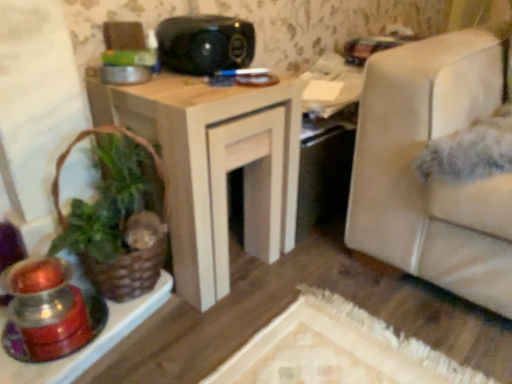
What is the approximate height of black plastic speaker at upper center?

black plastic speaker at upper center is 4.81 inches in height.

The width and height of the screenshot is (512, 384). Describe the element at coordinates (129, 274) in the screenshot. I see `brown woven basket at left` at that location.

Image resolution: width=512 pixels, height=384 pixels. What do you see at coordinates (215, 167) in the screenshot?
I see `wooden table at center` at bounding box center [215, 167].

This screenshot has height=384, width=512. I want to click on black plastic speaker at upper center, so click(205, 44).

From a real-world perspective, is black plastic speaker at upper center over wooden table at center?

Correct, in the physical world, black plastic speaker at upper center is higher than wooden table at center.

Is wooden table at center inside black plastic speaker at upper center?

No, wooden table at center is not inside black plastic speaker at upper center.

Image resolution: width=512 pixels, height=384 pixels. I want to click on speaker above the wooden table at center (from the image's perspective), so click(x=205, y=44).

Is black plastic speaker at upper center touching wooden table at center?

No, black plastic speaker at upper center is not beside wooden table at center.

Looking at this image, from the image's perspective, which one is positioned higher, wooden table at center or translucent glass candle holder at lower left?

wooden table at center, from the image's perspective.

In the scene shown: Is the surface of wooden table at center in direct contact with translucent glass candle holder at lower left?

No, wooden table at center is not beside translucent glass candle holder at lower left.

Is wooden table at center located outside translucent glass candle holder at lower left?

Yes, wooden table at center is located beyond the bounds of translucent glass candle holder at lower left.

Can you tell me how much wooden table at center and translucent glass candle holder at lower left differ in facing direction?

3.72 degrees.

Does translucent glass candle holder at lower left have a lesser width compared to wooden table at center?

Yes.

Is translucent glass candle holder at lower left spatially inside wooden table at center, or outside of it?

translucent glass candle holder at lower left is not enclosed by wooden table at center.

Considering the relative sizes of translucent glass candle holder at lower left and wooden table at center in the image provided, is translucent glass candle holder at lower left bigger than wooden table at center?

No.

How different are the orientations of translucent glass candle holder at lower left and wooden table at center in degrees?

translucent glass candle holder at lower left and wooden table at center are facing 3.72 degrees away from each other.

Which of these two, wooden table at center or black plastic speaker at upper center, is smaller?

black plastic speaker at upper center is smaller.

Can you tell me how much wooden table at center and black plastic speaker at upper center differ in facing direction?

1.79 degrees.

Is the surface of wooden table at center in direct contact with black plastic speaker at upper center?

wooden table at center and black plastic speaker at upper center are clearly separated.

Which of these two, wooden table at center or black plastic speaker at upper center, is thinner?

Thinner between the two is black plastic speaker at upper center.

Based on the photo, considering the sizes of objects wooden table at center and brown woven basket at left in the image provided, who is smaller, wooden table at center or brown woven basket at left?

With smaller size is brown woven basket at left.

I want to click on houseplant above the wooden table at center (from a real-world perspective), so click(129, 274).

From the picture: Relative to brown woven basket at left, is wooden table at center in front or behind?

wooden table at center is behind brown woven basket at left.

Does wooden table at center turn towards brown woven basket at left?

No, wooden table at center is not oriented towards brown woven basket at left.

Is black plastic speaker at upper center taller than brown woven basket at left?

No.

Based on their positions, is black plastic speaker at upper center located to the left or right of brown woven basket at left?

black plastic speaker at upper center is positioned on brown woven basket at left's right side.

Does point (216, 27) appear closer or farther from the camera than point (117, 283)?

Point (216, 27).

Is black plastic speaker at upper center further to the viewer compared to brown woven basket at left?

Yes, black plastic speaker at upper center is further from the camera.

Is translucent glass candle holder at lower left closer to camera compared to brown woven basket at left?

Yes, translucent glass candle holder at lower left is in front of brown woven basket at left.

Is brown woven basket at left surrounded by translucent glass candle holder at lower left?

No, brown woven basket at left is not surrounded by translucent glass candle holder at lower left.

Is translucent glass candle holder at lower left turned away from brown woven basket at left?

No, translucent glass candle holder at lower left is not facing the opposite direction of brown woven basket at left.

You are a GUI agent. You are given a task and a screenshot of the screen. Output one action in this format:
    pyautogui.click(x=<x>, y=<y>)
    Task: Click on the table lying in front of the black plastic speaker at upper center
    The width and height of the screenshot is (512, 384).
    Given the screenshot: What is the action you would take?
    pyautogui.click(x=215, y=167)

What are the coordinates of `table that appears behind the translucent glass candle holder at lower left` in the screenshot? It's located at (215, 167).

From the image, which object appears to be nearer to translucent glass candle holder at lower left, brown woven basket at left or wooden table at center?

Based on the image, brown woven basket at left appears to be nearer to translucent glass candle holder at lower left.

Looking at the image, which one is located further to black plastic speaker at upper center, translucent glass candle holder at lower left or wooden table at center?

Based on the image, translucent glass candle holder at lower left appears to be further to black plastic speaker at upper center.

When comparing their distances from black plastic speaker at upper center, does wooden table at center or brown woven basket at left seem closer?

wooden table at center is positioned closer to the anchor black plastic speaker at upper center.

Considering their positions, is black plastic speaker at upper center positioned closer to translucent glass candle holder at lower left than wooden table at center?

Based on the image, wooden table at center appears to be nearer to translucent glass candle holder at lower left.

Which object lies further to the anchor point wooden table at center, translucent glass candle holder at lower left or brown woven basket at left?

Based on the image, translucent glass candle holder at lower left appears to be further to wooden table at center.

Based on their spatial positions, is translucent glass candle holder at lower left or brown woven basket at left closer to black plastic speaker at upper center?

Among the two, brown woven basket at left is located nearer to black plastic speaker at upper center.

Based on their spatial positions, is brown woven basket at left or wooden table at center further from black plastic speaker at upper center?

brown woven basket at left is further to black plastic speaker at upper center.

Estimate the real-world distances between objects in this image. Which object is further from wooden table at center, translucent glass candle holder at lower left or black plastic speaker at upper center?

translucent glass candle holder at lower left is further to wooden table at center.

Where is `table between black plastic speaker at upper center and translucent glass candle holder at lower left from top to bottom`? table between black plastic speaker at upper center and translucent glass candle holder at lower left from top to bottom is located at coordinates (215, 167).

Identify the location of houseplant between black plastic speaker at upper center and translucent glass candle holder at lower left in the vertical direction. (129, 274).

The height and width of the screenshot is (384, 512). Identify the location of table between black plastic speaker at upper center and brown woven basket at left vertically. (215, 167).

You are a GUI agent. You are given a task and a screenshot of the screen. Output one action in this format:
    pyautogui.click(x=<x>, y=<y>)
    Task: Click on the houseplant situated between translucent glass candle holder at lower left and wooden table at center from left to right
    This screenshot has height=384, width=512.
    Given the screenshot: What is the action you would take?
    pyautogui.click(x=129, y=274)